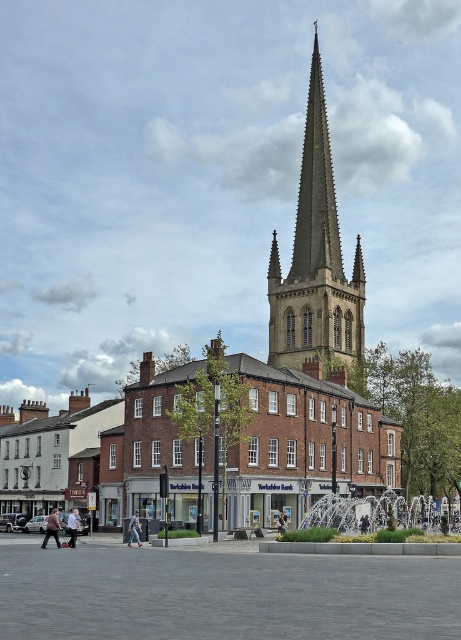
From the picture: Which is above, smooth stone spire at center or matte pink shirt at center?

smooth stone spire at center

Does point (284, 284) lie behind point (55, 518)?

Yes, it is.

Image resolution: width=461 pixels, height=640 pixels. I want to click on smooth stone spire at center, so click(x=315, y=259).

Is point (53, 516) less distant than point (137, 541)?

Yes, it is in front of point (137, 541).

Image resolution: width=461 pixels, height=640 pixels. What do you see at coordinates (52, 529) in the screenshot? I see `matte pink shirt at center` at bounding box center [52, 529].

Is point (47, 529) positioned in front of point (137, 532)?

Yes, it is.

Find the location of a particular element. matte pink shirt at center is located at coordinates (52, 529).

What do you see at coordinates (315, 259) in the screenshot? This screenshot has width=461, height=640. I see `smooth stone spire at center` at bounding box center [315, 259].

Does point (302, 188) lie behind point (139, 534)?

Yes.

At what (x,y) coordinates should I click in order to perform the action: click on smooth stone spire at center. Please return your answer as a coordinate pair (x, y). Image resolution: width=461 pixels, height=640 pixels. Looking at the image, I should click on (315, 259).